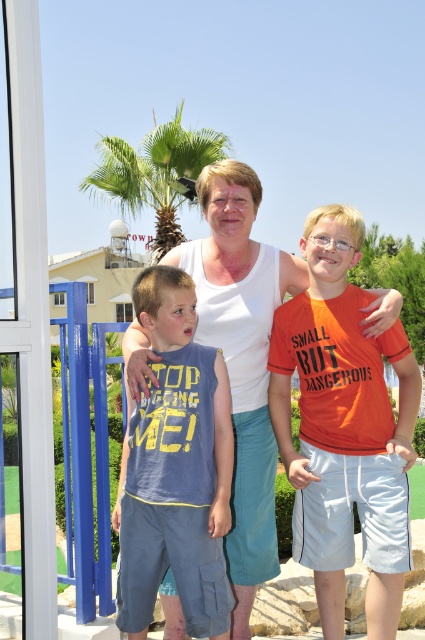
You are a photographer trying to capture a group photo of the blue cotton shirt at center and the green leafy palm tree at upper center. Which object appears narrower in the photo?

The blue cotton shirt at center appears narrower in the photo than the green leafy palm tree at upper center because it is thinner.

You are a photographer trying to capture a group photo of the blue cotton shirt at center and the green leafy palm tree at upper center. The camera you are using has a maximum focus range of 20 meters. Will you be able to focus on both subjects simultaneously?

The distance between the blue cotton shirt at center and the green leafy palm tree at upper center is 20.15 meters, which exceeds the camera maximum focus range of 20 meters. Therefore, you cannot focus on both subjects simultaneously.